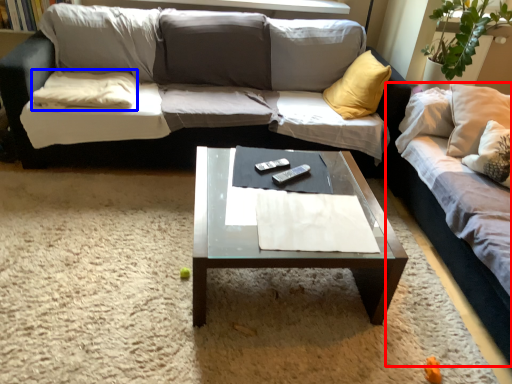
Question: Which object is closer to the camera taking this photo, studio couch (highlighted by a red box) or pillow (highlighted by a blue box)?

Choices:
 (A) studio couch
 (B) pillow

Answer: (A)